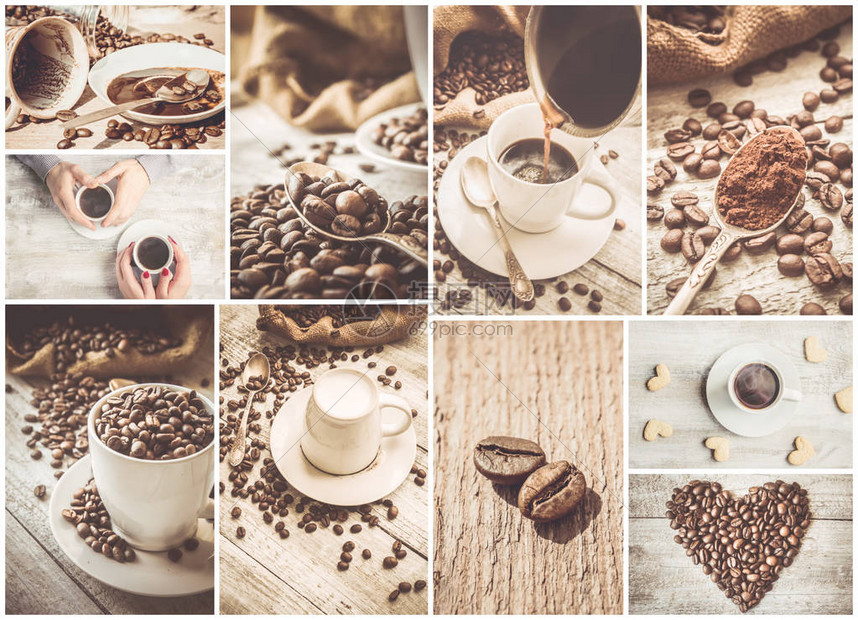
The image size is (858, 620). In order to click on cup handle in this screenshot , I will do `click(207, 514)`, `click(403, 428)`, `click(795, 391)`, `click(594, 177)`, `click(171, 273)`, `click(13, 117)`.